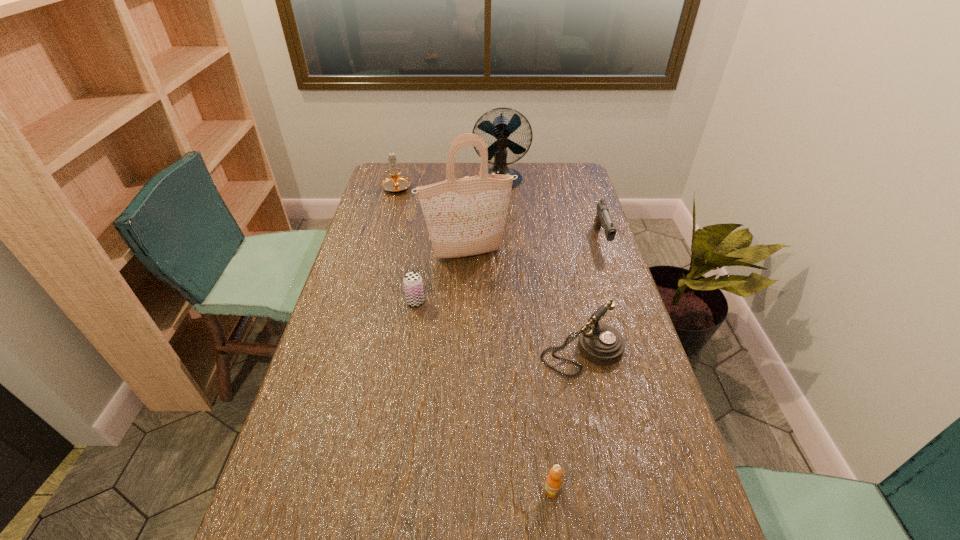
Choose which object is the third nearest neighbor to the third tallest object. Please provide its 2D coordinates. Your answer should be formatted as a tuple, i.e. [(x, y)], where the tuple contains the x and y coordinates of a point satisfying the conditions above.

[(413, 285)]

Identify which object is the fourth nearest to the third nearest object. Please provide its 2D coordinates. Your answer should be formatted as a tuple, i.e. [(x, y)], where the tuple contains the x and y coordinates of a point satisfying the conditions above.

[(553, 483)]

You are a GUI agent. You are given a task and a screenshot of the screen. Output one action in this format:
    pyautogui.click(x=<x>, y=<y>)
    Task: Click on the vacant region that satisfies the following two spatial constraints: 1. on the front-facing side of the telephone; 2. on the right side of the fan
    The width and height of the screenshot is (960, 540).
    Given the screenshot: What is the action you would take?
    pyautogui.click(x=512, y=352)